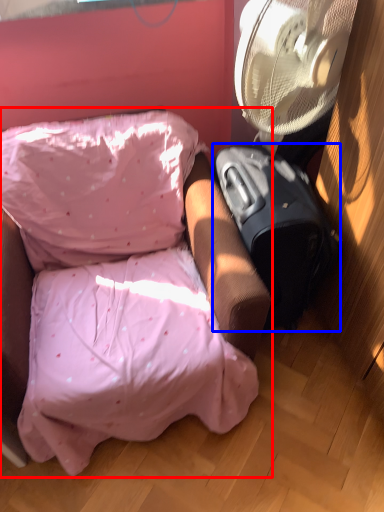
Question: Which point is further to the camera, furniture (highlighted by a red box) or luggage (highlighted by a blue box)?

Choices:
 (A) furniture
 (B) luggage

Answer: (B)